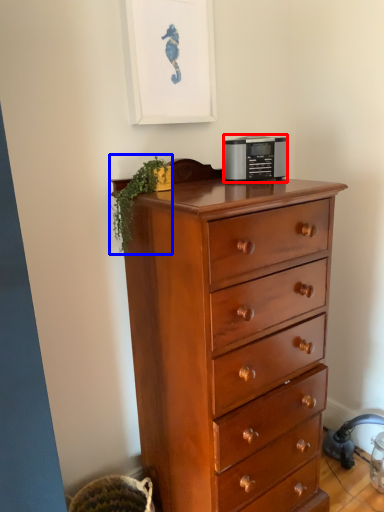
Question: Which object is further to the camera taking this photo, appliance (highlighted by a red box) or plant (highlighted by a blue box)?

Choices:
 (A) appliance
 (B) plant

Answer: (A)